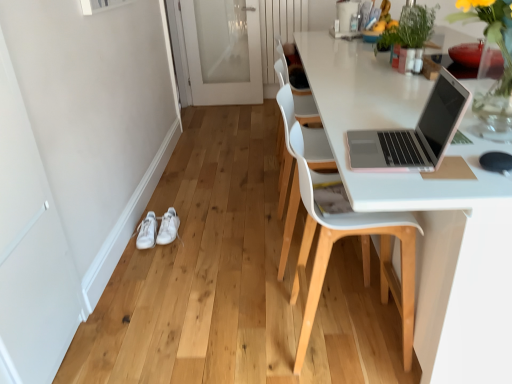
Question: Is white frosted glass screen door at center, which is the second screen door in bottom-to-top order, positioned with its back to pink plastic laptop at upper right?

Choices:
 (A) no
 (B) yes

Answer: (A)

Question: Would you say white frosted glass screen door at center, arranged as the 1th screen door when viewed from the right, contains pink plastic laptop at upper right?

Choices:
 (A) yes
 (B) no

Answer: (B)

Question: Is white frosted glass screen door at center, which is the second screen door in bottom-to-top order, far from pink plastic laptop at upper right?

Choices:
 (A) yes
 (B) no

Answer: (A)

Question: From a real-world perspective, is white frosted glass screen door at center, which is the second screen door in bottom-to-top order, physically below pink plastic laptop at upper right?

Choices:
 (A) no
 (B) yes

Answer: (B)

Question: Is white frosted glass screen door at center, the 1th screen door positioned from the top, at the left side of pink plastic laptop at upper right?

Choices:
 (A) yes
 (B) no

Answer: (A)

Question: Is white frosted glass screen door at center, the 2th screen door in the front-to-back sequence, thinner than pink plastic laptop at upper right?

Choices:
 (A) yes
 (B) no

Answer: (A)

Question: From a real-world perspective, is pink plastic laptop at upper right over white leather sneakers at lower left, the 1th footwear from the left?

Choices:
 (A) yes
 (B) no

Answer: (A)

Question: Is pink plastic laptop at upper right facing away from white leather sneakers at lower left, the 1th footwear from the left?

Choices:
 (A) yes
 (B) no

Answer: (B)

Question: From the image's perspective, would you say pink plastic laptop at upper right is shown under white leather sneakers at lower left, the 1th footwear from the left?

Choices:
 (A) no
 (B) yes

Answer: (A)

Question: From a real-world perspective, is pink plastic laptop at upper right positioned under white leather sneakers at lower left, the 1th footwear from the left, based on gravity?

Choices:
 (A) yes
 (B) no

Answer: (B)

Question: Are pink plastic laptop at upper right and white leather sneakers at lower left, the second footwear in the right-to-left sequence, making contact?

Choices:
 (A) no
 (B) yes

Answer: (A)

Question: Is pink plastic laptop at upper right behind white leather sneakers at lower left, the second footwear in the right-to-left sequence?

Choices:
 (A) yes
 (B) no

Answer: (B)

Question: Is white leather sneakers at lower left, positioned as the 1th footwear in right-to-left order, wider than green leafy plant at upper right?

Choices:
 (A) yes
 (B) no

Answer: (A)